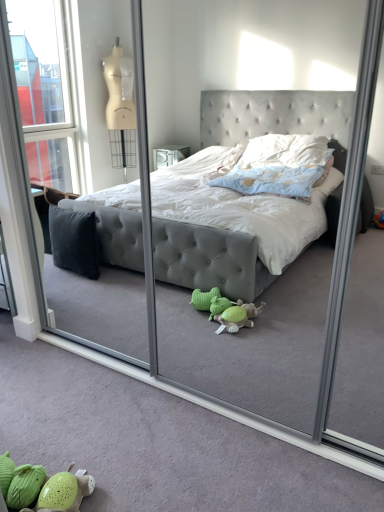
What is the approximate width of soft green plush toy at lower left?

12.39 inches.

What do you see at coordinates (42, 488) in the screenshot? This screenshot has width=384, height=512. I see `soft green plush toy at lower left` at bounding box center [42, 488].

Measure the distance between point (18,477) and camera.

A distance of 1.36 meters exists between point (18,477) and camera.

Locate an element on the screen. This screenshot has width=384, height=512. soft green plush toy at lower left is located at coordinates (42, 488).

The image size is (384, 512). Find the location of `soft green plush toy at lower left`. soft green plush toy at lower left is located at coordinates pos(42,488).